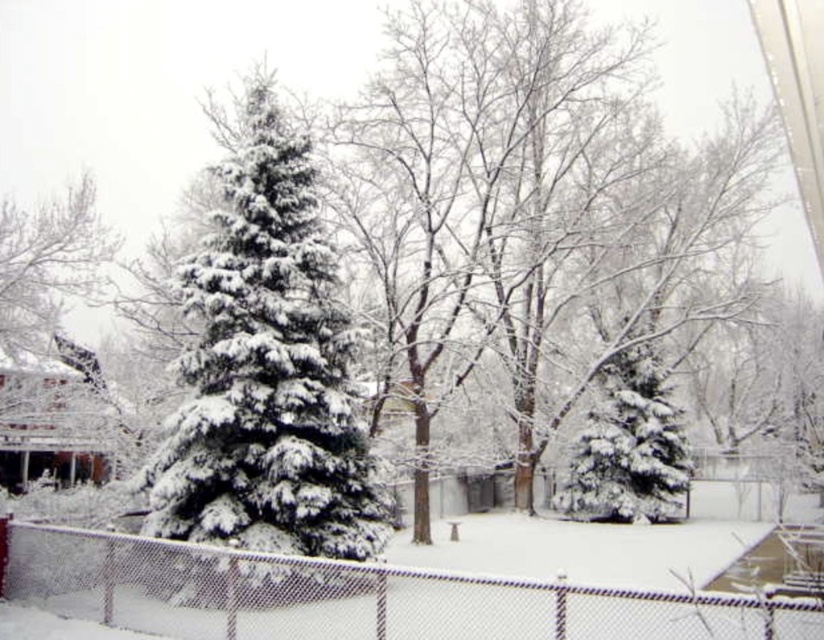
Question: Estimate the real-world distances between objects in this image. Which object is closer to the snow-covered fir tree at center-right?

Choices:
 (A) white chain-link fence at center
 (B) green matte/fuzzy fir tree at center

Answer: (A)

Question: From the image, what is the correct spatial relationship of green matte/fuzzy fir tree at center in relation to snow-covered fir tree at center-right?

Choices:
 (A) left
 (B) right

Answer: (A)

Question: Does white chain-link fence at center come behind snow-covered fir tree at center-right?

Choices:
 (A) no
 (B) yes

Answer: (A)

Question: Is green matte/fuzzy fir tree at center closer to the viewer compared to snow-covered fir tree at center-right?

Choices:
 (A) no
 (B) yes

Answer: (B)

Question: Estimate the real-world distances between objects in this image. Which object is closer to the green matte/fuzzy fir tree at center?

Choices:
 (A) snow-covered fir tree at center-right
 (B) white chain-link fence at center

Answer: (B)

Question: Which of the following is the closest to the observer?

Choices:
 (A) (12, 577)
 (B) (300, 244)

Answer: (A)